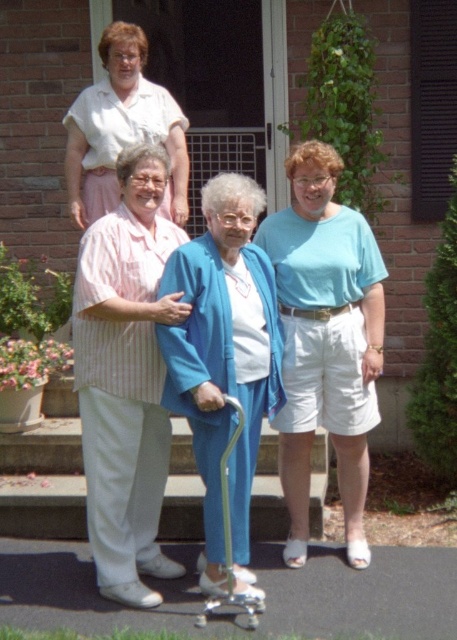
Question: Is white striped shirt at center closer to the viewer compared to pink fabric blouse at upper left?

Choices:
 (A) yes
 (B) no

Answer: (A)

Question: Which object appears closest to the camera in this image?

Choices:
 (A) blue fabric cane at center
 (B) white striped shirt at center

Answer: (A)

Question: Is white striped shirt at center positioned at the back of blue fabric cane at center?

Choices:
 (A) yes
 (B) no

Answer: (A)

Question: Which object appears farthest from the camera in this image?

Choices:
 (A) light blue cotton shirt at center
 (B) white striped shirt at center

Answer: (A)

Question: Which object is positioned farthest from the light blue cotton shirt at center?

Choices:
 (A) blue fabric cane at center
 (B) white striped shirt at center
 (C) pink fabric blouse at upper left

Answer: (C)

Question: Can you confirm if blue fabric cane at center is positioned to the left of pink fabric blouse at upper left?

Choices:
 (A) no
 (B) yes

Answer: (A)